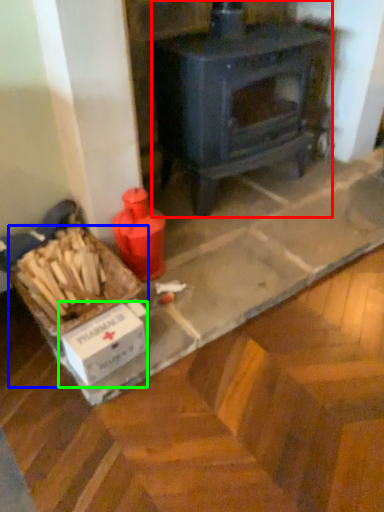
Question: Based on their relative distances, which object is farther from wood burning stove (highlighted by a red box)? Choose from box (highlighted by a blue box) and cardboard box (highlighted by a green box).

Choices:
 (A) box
 (B) cardboard box

Answer: (B)